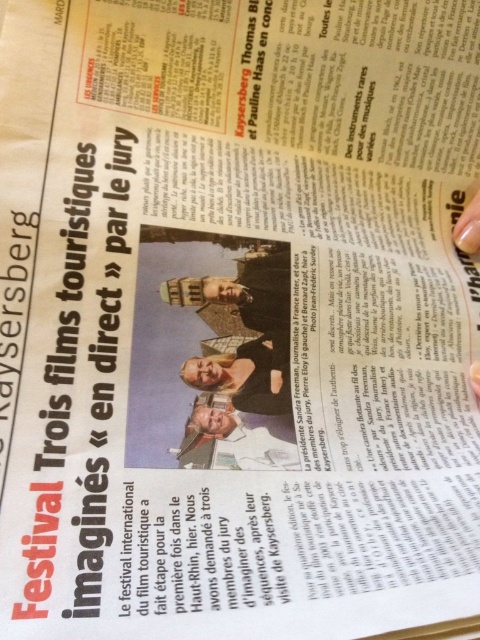
Who is more distant from viewer, (192,276) or (277,348)?

The point (277,348) is more distant.

Which is above, matte brown statue at center or smooth beige suit at center?

matte brown statue at center

Is point (261, 308) closer to camera compared to point (274, 355)?

No.

Locate an element on the screen. matte brown statue at center is located at coordinates (240, 292).

Based on the photo, does matte white face at center appear over smooth beige suit at center?

No, matte white face at center is not above smooth beige suit at center.

Image resolution: width=480 pixels, height=640 pixels. Describe the element at coordinates (236, 436) in the screenshot. I see `matte white face at center` at that location.

Find the location of `matte white face at center`. matte white face at center is located at coordinates (236, 436).

Is matte brown statue at center wider than matte white face at center?

Indeed, matte brown statue at center has a greater width compared to matte white face at center.

Is the position of matte brown statue at center more distant than that of matte white face at center?

Yes, matte brown statue at center is behind matte white face at center.

Is point (274, 314) positioned behind point (192, 417)?

Yes, it is behind point (192, 417).

The image size is (480, 640). I want to click on matte brown statue at center, so click(240, 292).